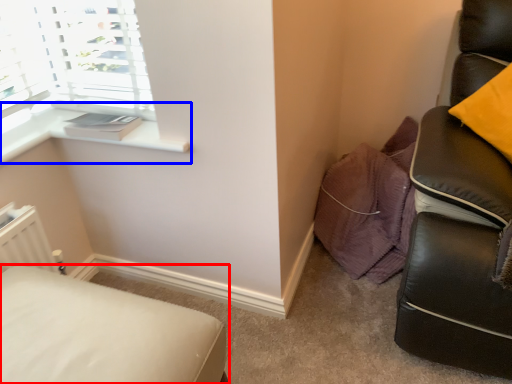
Question: Which of the following is the closest to the observer, furniture (highlighted by a red box) or window sill (highlighted by a blue box)?

Choices:
 (A) furniture
 (B) window sill

Answer: (A)